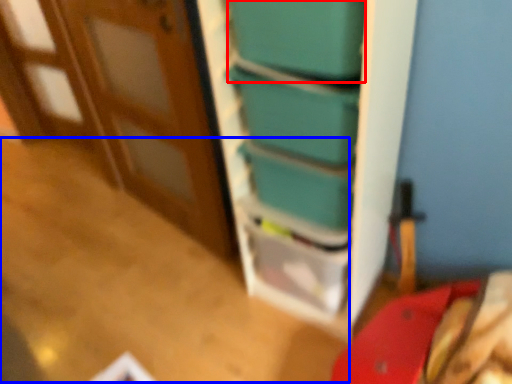
Question: Among these objects, which one is nearest to the camera, box (highlighted by a red box) or table (highlighted by a blue box)?

Choices:
 (A) box
 (B) table

Answer: (A)